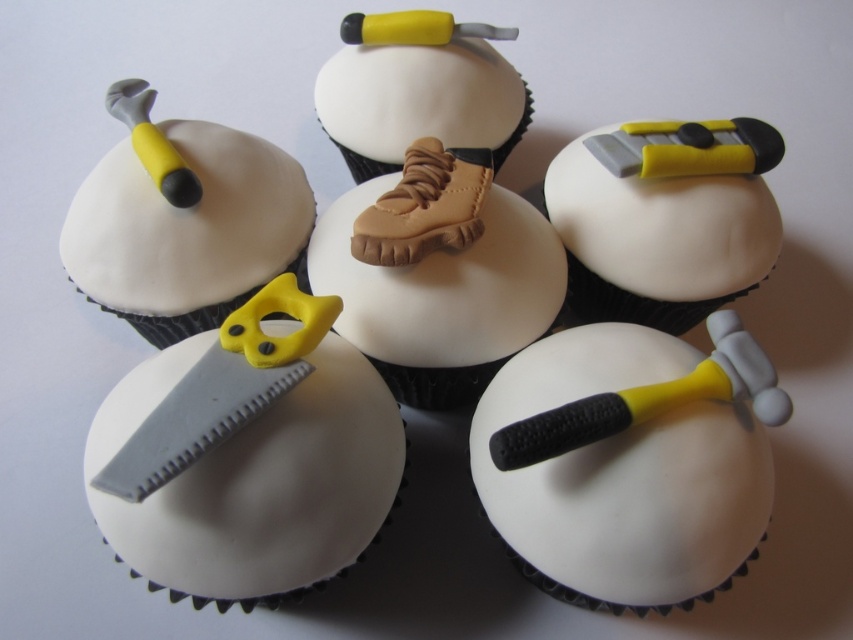
You are standing in front of the cupcakes and want to take a photo of the matte yellow plastic scissors at left and the camera. How far apart are they?

The matte yellow plastic scissors at left and the camera are 1.09 meters apart from each other.

You are a baker who needs to place a 40 cm wide cake box between the yellow matte hammer at lower right and the matte white shoe at center. Will the box fit without overlapping either cupcake?

The distance between the yellow matte hammer at lower right and the matte white shoe at center is 45.37 centimeters. Since the cake box is 40 cm wide, it will fit as there is enough space between them.